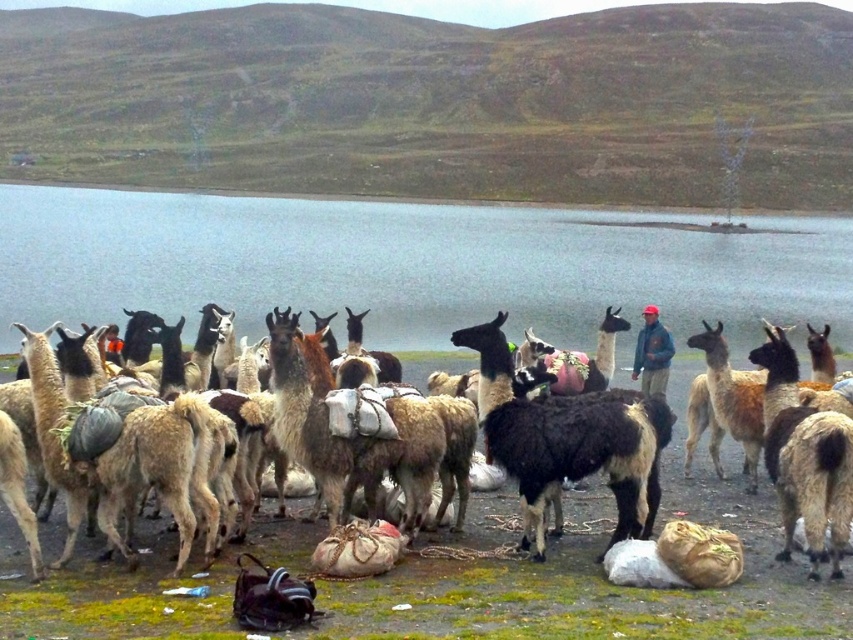
Question: Does blue water at center have a lesser width compared to dark blue jacket at center?

Choices:
 (A) yes
 (B) no

Answer: (B)

Question: Is the position of blue water at center less distant than that of dark blue jacket at center?

Choices:
 (A) no
 (B) yes

Answer: (A)

Question: Which object is positioned closest to the black and white woolen alpaca at center?

Choices:
 (A) blue water at center
 (B) dark blue jacket at center

Answer: (B)

Question: Based on their relative distances, which object is farther from the dark blue jacket at center?

Choices:
 (A) blue water at center
 (B) black and white woolen alpaca at center

Answer: (A)

Question: Does blue water at center have a lesser width compared to black and white woolen alpaca at center?

Choices:
 (A) no
 (B) yes

Answer: (A)

Question: Which point is farther from the camera taking this photo?

Choices:
 (A) (659, 326)
 (B) (177, 246)
 (C) (633, 438)

Answer: (B)